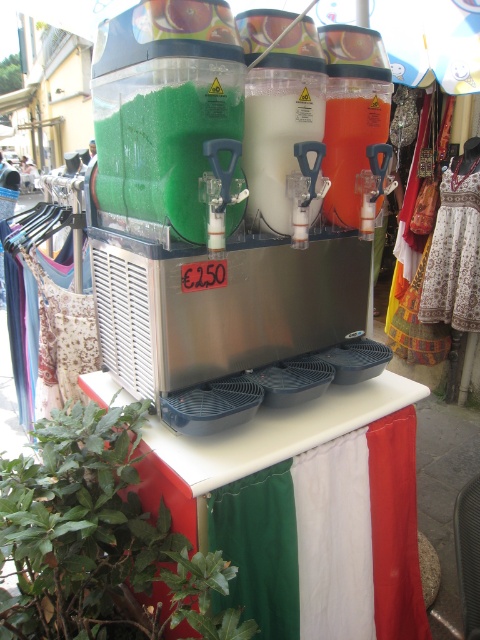
Which is more to the left, green translucent slush machine at center or white plastic table at center?

Positioned to the left is green translucent slush machine at center.

Between point (344, 381) and point (358, 589), which one is positioned behind?

Positioned behind is point (358, 589).

Identify the location of green translucent slush machine at center. (228, 204).

Image resolution: width=480 pixels, height=640 pixels. Find the location of `green translucent slush machine at center`. green translucent slush machine at center is located at coordinates (228, 204).

Which is behind, point (420, 387) or point (129, 497)?

The point (420, 387) is behind.

Between point (343, 412) and point (104, 408), which one is positioned in front?

Point (104, 408)

Locate an element on the screen. Image resolution: width=480 pixels, height=640 pixels. white plastic table at center is located at coordinates (319, 499).

Does green leafy plant at lower left have a greater width compared to white plastic milkshake at center?

Yes, green leafy plant at lower left is wider than white plastic milkshake at center.

Is the position of green leafy plant at lower left less distant than that of white plastic milkshake at center?

Yes, green leafy plant at lower left is closer to the viewer.

Find the location of a particular element. This screenshot has height=640, width=480. green leafy plant at lower left is located at coordinates (97, 540).